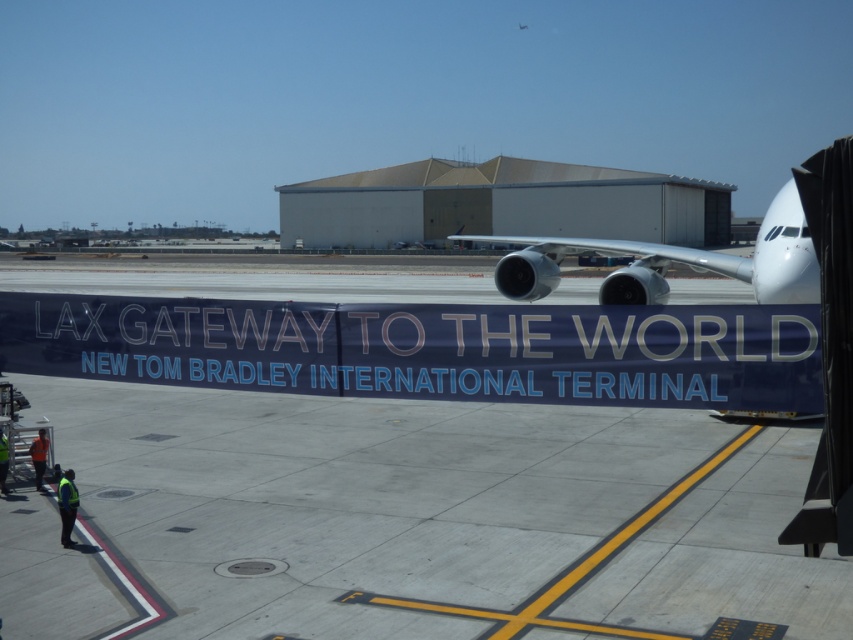
Between white corrugated metal hangar at center and silver metallic airplane at right, which one has more height?

white corrugated metal hangar at center is taller.

Who is shorter, white corrugated metal hangar at center or silver metallic airplane at right?

Standing shorter between the two is silver metallic airplane at right.

Does point (326, 204) lie in front of point (538, 260)?

No.

This screenshot has height=640, width=853. Identify the location of white corrugated metal hangar at center. (502, 204).

Can you confirm if gray concrete tarmac at center is smaller than silver metallic airplane at right?

Yes.

Between point (669, 561) and point (786, 198), which one is positioned behind?

The point (786, 198) is more distant.

Which is in front, point (375, 589) or point (811, 273)?

Point (375, 589) is in front.

Where is `gray concrete tarmac at center`? The width and height of the screenshot is (853, 640). gray concrete tarmac at center is located at coordinates (439, 512).

Is gray concrete tarmac at center above white corrugated metal hangar at center?

Actually, gray concrete tarmac at center is below white corrugated metal hangar at center.

Find the location of a particular element. gray concrete tarmac at center is located at coordinates (439, 512).